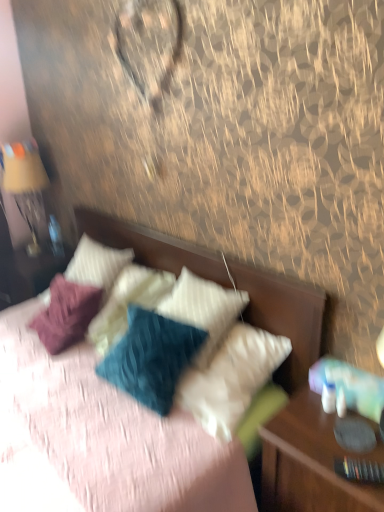
Question: Is white textured pillow at upper center, the first pillow from the right, further to camera compared to textured fabric bed at center?

Choices:
 (A) no
 (B) yes

Answer: (B)

Question: Are white textured pillow at upper center, the first pillow from the right, and textured fabric bed at center making contact?

Choices:
 (A) no
 (B) yes

Answer: (A)

Question: Does white textured pillow at upper center, the first pillow from the right, have a larger size compared to textured fabric bed at center?

Choices:
 (A) no
 (B) yes

Answer: (A)

Question: From the image's perspective, does white textured pillow at upper center, the first pillow from the right, appear lower than textured fabric bed at center?

Choices:
 (A) no
 (B) yes

Answer: (A)

Question: From the image's perspective, does white textured pillow at upper center, the first pillow from the right, appear higher than textured fabric bed at center?

Choices:
 (A) no
 (B) yes

Answer: (B)

Question: Visually, is white textured pillow at center, marked as the 1th pillow in a left-to-right arrangement, positioned to the left or to the right of matte gold lamp at left?

Choices:
 (A) right
 (B) left

Answer: (A)

Question: From the image's perspective, is white textured pillow at center, marked as the 1th pillow in a left-to-right arrangement, located above or below matte gold lamp at left?

Choices:
 (A) above
 (B) below

Answer: (B)

Question: Which is correct: white textured pillow at center, which ranks as the 2th pillow in right-to-left order, is inside matte gold lamp at left, or outside of it?

Choices:
 (A) inside
 (B) outside

Answer: (B)

Question: From a real-world perspective, is white textured pillow at center, which ranks as the 2th pillow in right-to-left order, physically located above or below matte gold lamp at left?

Choices:
 (A) below
 (B) above

Answer: (A)

Question: Considering their positions, is white textured pillow at upper center, placed as the 2th pillow when sorted from left to right, located in front of or behind matte gold lamp at left?

Choices:
 (A) behind
 (B) front

Answer: (B)

Question: Is white textured pillow at upper center, the first pillow from the right, taller or shorter than matte gold lamp at left?

Choices:
 (A) tall
 (B) short

Answer: (B)

Question: From the image's perspective, relative to matte gold lamp at left, is white textured pillow at upper center, placed as the 2th pillow when sorted from left to right, above or below?

Choices:
 (A) below
 (B) above

Answer: (A)

Question: Is point (192, 307) closer or farther from the camera than point (28, 211)?

Choices:
 (A) closer
 (B) farther

Answer: (A)

Question: From their relative heights in the image, would you say white textured pillow at center, marked as the 1th pillow in a left-to-right arrangement, is taller or shorter than white textured pillow at upper center, placed as the 2th pillow when sorted from left to right?

Choices:
 (A) tall
 (B) short

Answer: (A)

Question: In the image, is white textured pillow at center, marked as the 1th pillow in a left-to-right arrangement, positioned in front of or behind white textured pillow at upper center, the first pillow from the right?

Choices:
 (A) behind
 (B) front

Answer: (A)